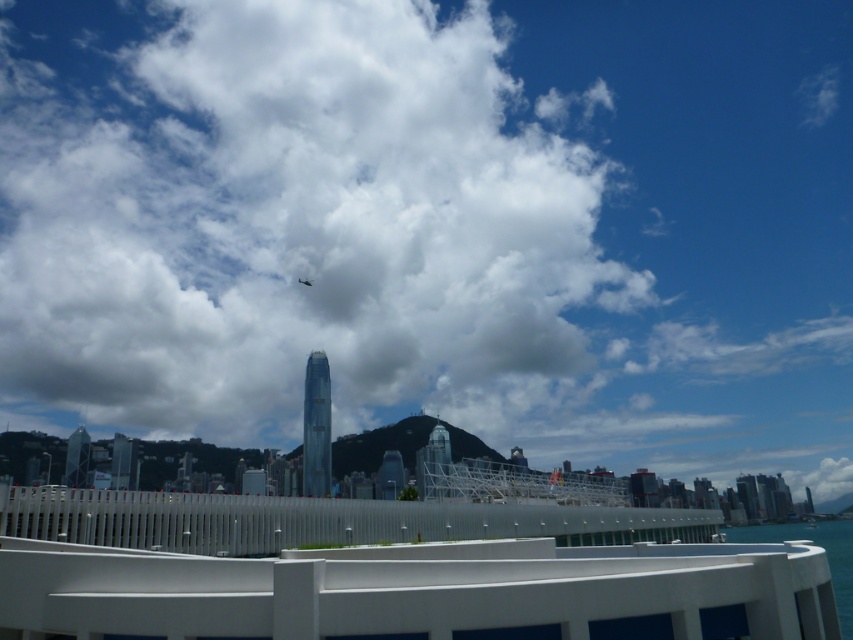
In the scene shown: Is white fluffy cloud at upper center bigger than silver metallic rail at center?

Correct, white fluffy cloud at upper center is larger in size than silver metallic rail at center.

Does point (578, 413) lie behind point (451, 529)?

Yes, point (578, 413) is farther from viewer.

This screenshot has height=640, width=853. I want to click on white fluffy cloud at upper center, so click(299, 225).

This screenshot has height=640, width=853. In order to click on silver metallic rail at center in this screenshot , I will do `click(321, 522)`.

Between silver metallic rail at center and blue water at lower right, which one appears on the left side from the viewer's perspective?

Positioned to the left is silver metallic rail at center.

Describe the element at coordinates (321, 522) in the screenshot. Image resolution: width=853 pixels, height=640 pixels. I see `silver metallic rail at center` at that location.

I want to click on silver metallic rail at center, so click(x=321, y=522).

Which of these two, white fluffy cloud at upper center or blue water at lower right, stands taller?

white fluffy cloud at upper center

Is white fluffy cloud at upper center behind blue water at lower right?

Yes, it is behind blue water at lower right.

Is point (218, 193) closer to camera compared to point (757, 529)?

No, (218, 193) is behind (757, 529).

Locate an element on the screen. The image size is (853, 640). white fluffy cloud at upper center is located at coordinates (299, 225).